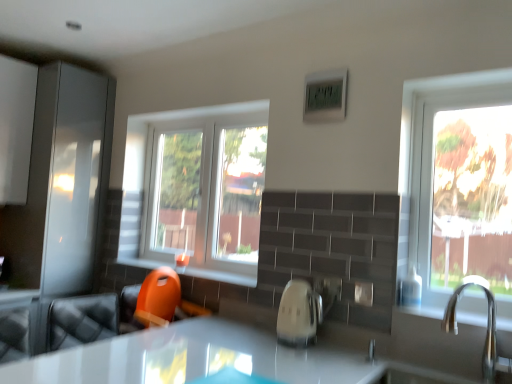
Question: Based on their positions, is clear glass window at center located to the left or right of silver metallic faucet at right?

Choices:
 (A) right
 (B) left

Answer: (B)

Question: From their relative heights in the image, would you say clear glass window at center is taller or shorter than silver metallic faucet at right?

Choices:
 (A) short
 (B) tall

Answer: (B)

Question: Which object is the closest to the orange plastic toy at lower center?

Choices:
 (A) white glossy kettle at center
 (B) clear glass window at center
 (C) matte gray cabinet at left
 (D) orange plastic swivel chair at lower left
 (E) silver metallic faucet at right

Answer: (D)

Question: Estimate the real-world distances between objects in this image. Which object is closer to the white glossy kettle at center?

Choices:
 (A) clear glass window at center
 (B) orange plastic toy at lower center
 (C) silver metallic faucet at right
 (D) orange plastic swivel chair at lower left
 (E) matte gray cabinet at left

Answer: (B)